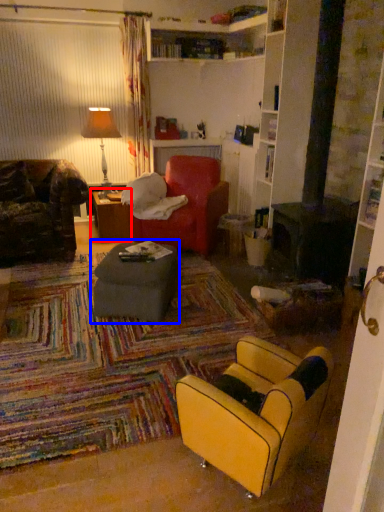
Question: Which object appears closest to the camera in this image, table (highlighted by a red box) or table (highlighted by a blue box)?

Choices:
 (A) table
 (B) table

Answer: (B)